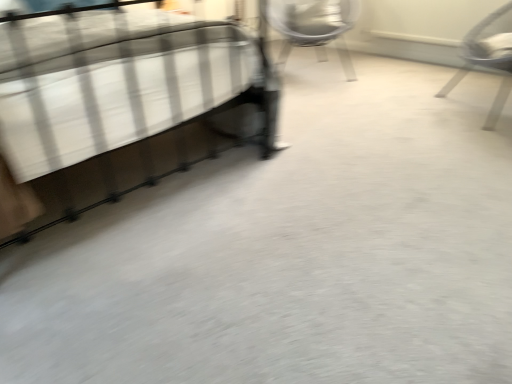
Image resolution: width=512 pixels, height=384 pixels. I want to click on free spot below metallic silver bed at left (from a real-world perspective), so click(150, 164).